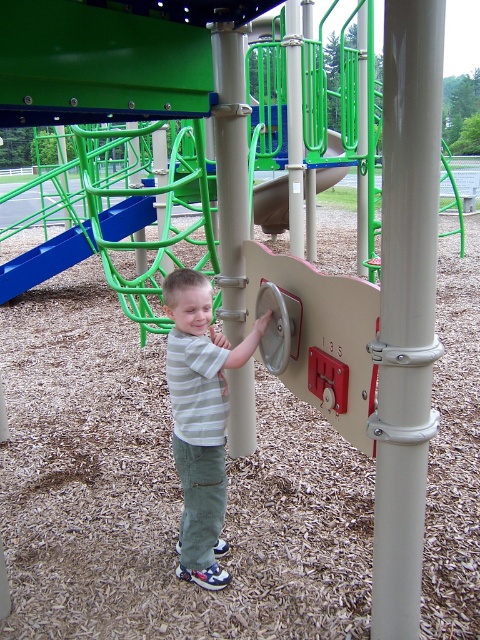
Does white glossy pole at center appear under green plastic slide at upper center?

Indeed, white glossy pole at center is positioned under green plastic slide at upper center.

Does point (422, 316) come farther from viewer compared to point (10, 276)?

No, it is not.

The width and height of the screenshot is (480, 640). I want to click on white glossy pole at center, so click(x=406, y=308).

Can you confirm if white glossy pole at center is shorter than striped cotton shirt at center?

In fact, white glossy pole at center may be taller than striped cotton shirt at center.

Does white glossy pole at center have a smaller size compared to striped cotton shirt at center?

Actually, white glossy pole at center might be larger than striped cotton shirt at center.

Is point (414, 614) positioned in front of point (225, 548)?

Yes.

Find the location of a particular element. The height and width of the screenshot is (640, 480). white glossy pole at center is located at coordinates (406, 308).

Which is in front, point (224, 138) or point (28, 259)?

Positioned in front is point (224, 138).

Between smooth beige pole at center and green plastic slide at upper center, which one has less height?

smooth beige pole at center

Who is more distant from viewer, [222,246] or [70,236]?

Point [70,236]

In order to click on smooth beige pole at center in this screenshot , I will do `click(230, 172)`.